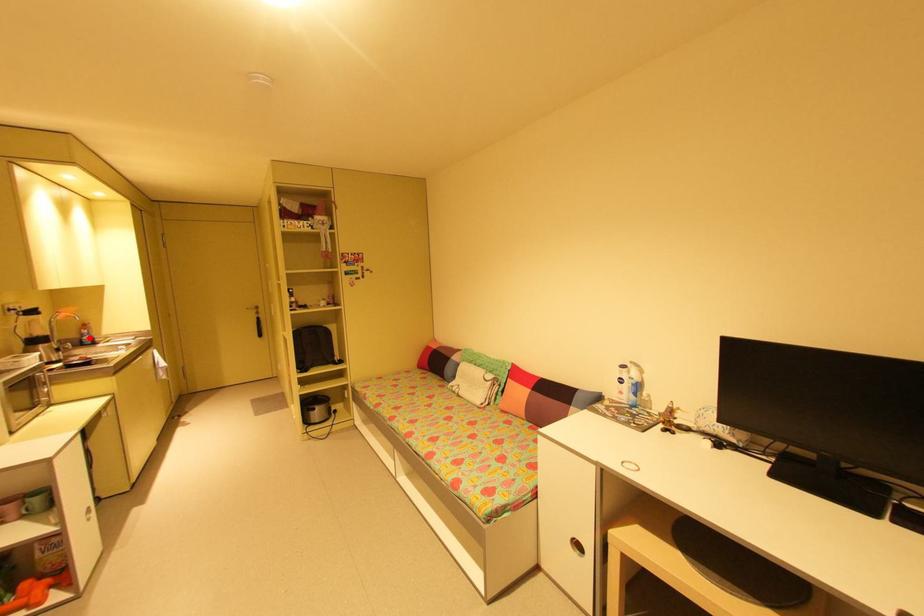
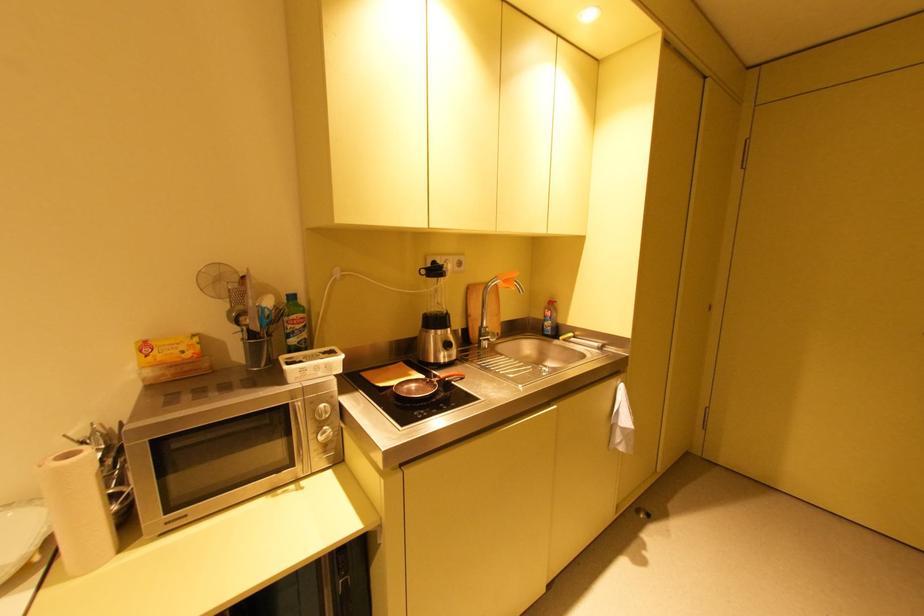
Find the pixel in the second image that matches the highlighted location in the first image.

(551, 323)